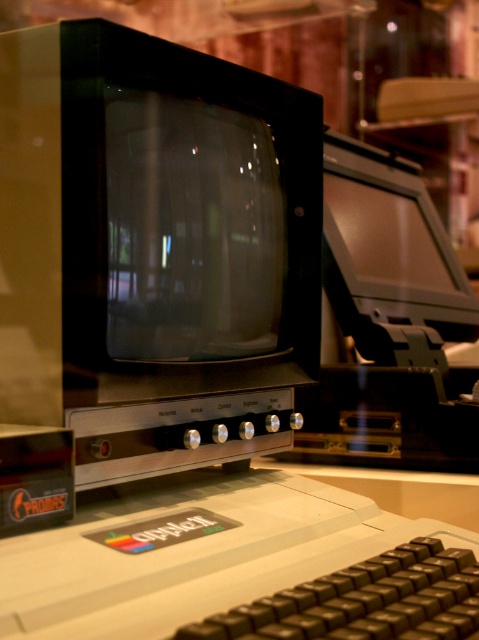
You are setting up a desk for a retro computing enthusiast. You have a matte black monitor at upper right and a black plastic keyboard at lower center. Which object should be placed higher on the desk to ensure proper visibility and ergonomics?

The matte black monitor at upper right should be placed higher on the desk since it is taller than the black plastic keyboard at lower center, aligning with ergonomic principles for better visibility.

You are setting up a new Apple II computer and need to place the white plastic keyboard at lower center and the matte black monitor at upper right. According to the setup instructions, the keyboard must be placed to the left of the monitor. Does the current arrangement comply with the instructions?

Yes, the white plastic keyboard at lower center is positioned on the left side of the matte black monitor at upper right, so the current arrangement complies with the instructions.

You are setting up a desk for an Apple II computer display. The desk has limited space, and you need to place both the matte black monitor at upper right and the black plastic keyboard at lower center. Given their sizes, which object should be placed first to ensure proper positioning?

The matte black monitor at upper right should be placed first because it is larger than the black plastic keyboard at lower center, allowing for better spatial planning.